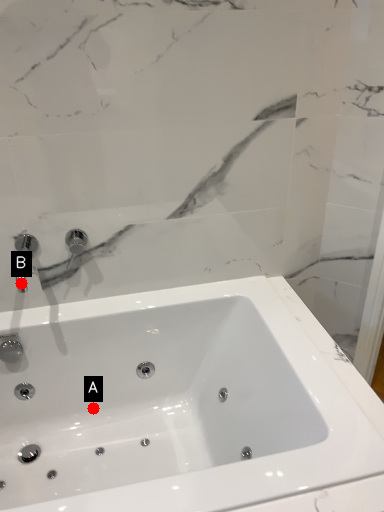
Question: Two points are circled on the image, labeled by A and B beside each circle. Which point is closer to the camera?

Choices:
 (A) A is closer
 (B) B is closer

Answer: (B)